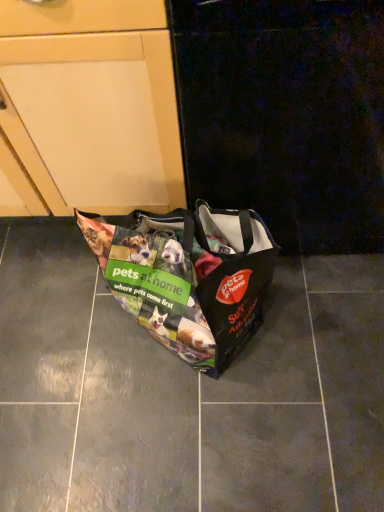
Identify the location of free location in front of polyester tote bag at center. (201, 442).